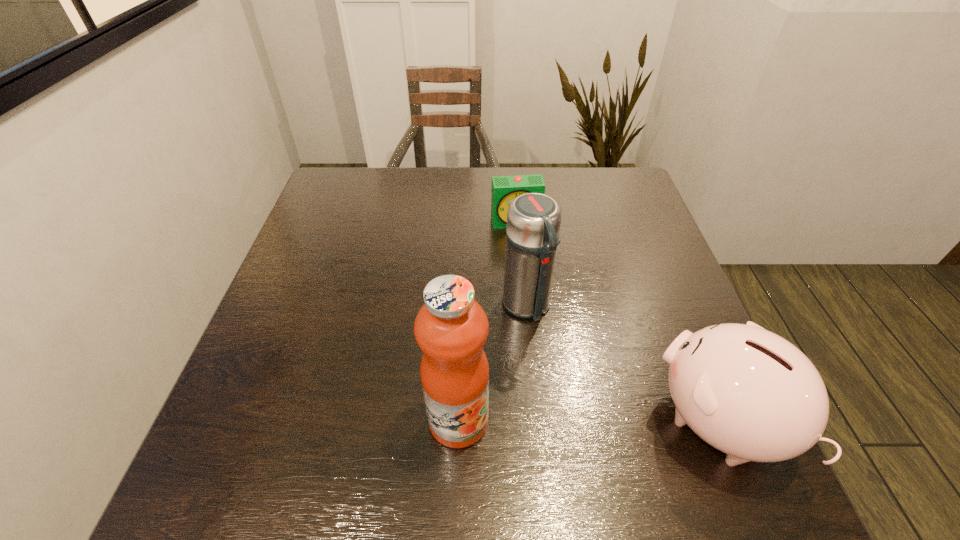
In the image, there is a desktop. Where is `vacant space at the left edge`? Image resolution: width=960 pixels, height=540 pixels. vacant space at the left edge is located at coordinates (254, 350).

You are a GUI agent. You are given a task and a screenshot of the screen. Output one action in this format:
    pyautogui.click(x=<x>, y=<y>)
    Task: Click on the vacant area at the right edge
    
    Given the screenshot: What is the action you would take?
    pyautogui.click(x=677, y=288)

This screenshot has height=540, width=960. In order to click on vacant space at the far left corner of the desktop in this screenshot , I will do `click(354, 168)`.

In the image, there is a desktop. Identify the location of vacant space at the near left corner. The height and width of the screenshot is (540, 960). (311, 406).

In the image, there is a desktop. Where is `vacant area at the far right corner`? vacant area at the far right corner is located at coordinates (612, 197).

Find the location of `vacant area between the farthest object and the rightmost object`. vacant area between the farthest object and the rightmost object is located at coordinates (617, 321).

Image resolution: width=960 pixels, height=540 pixels. Find the location of `blank region between the farthest object and the piggy bank`. blank region between the farthest object and the piggy bank is located at coordinates click(617, 321).

Find the location of a particular element. This screenshot has width=960, height=540. free spot between the rightmost object and the leftmost object is located at coordinates (588, 421).

Where is `vacant point located between the leftmost object and the thermos bottle`? The image size is (960, 540). vacant point located between the leftmost object and the thermos bottle is located at coordinates (492, 363).

Identify the location of vacant space that's between the second tallest object and the second shortest object. The image size is (960, 540). (622, 363).